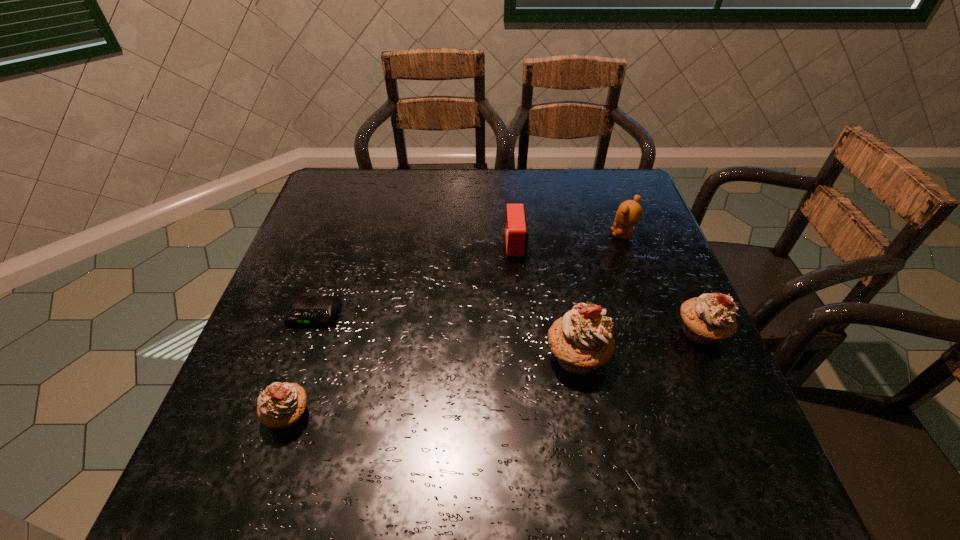
At what (x,y) coordinates should I click in order to perform the action: click on the shortest cupcake. Please return your answer as a coordinate pair (x, y). Looking at the image, I should click on (281, 405).

The width and height of the screenshot is (960, 540). In order to click on the leftmost cupcake in this screenshot , I will do `click(281, 405)`.

Locate an element on the screen. the tallest object is located at coordinates pyautogui.click(x=582, y=341).

I want to click on the second cupcake from left to right, so (x=582, y=341).

This screenshot has width=960, height=540. Identify the location of the rightmost cupcake. (709, 318).

In order to click on the rightmost object in this screenshot , I will do `click(709, 318)`.

Where is `the fourth object from right to left`? Image resolution: width=960 pixels, height=540 pixels. the fourth object from right to left is located at coordinates (516, 232).

I want to click on the farther alarm clock, so click(516, 232).

What are the coordinates of `teddy bear` in the screenshot? It's located at (629, 213).

The width and height of the screenshot is (960, 540). Find the location of `the shortest object`. the shortest object is located at coordinates (303, 310).